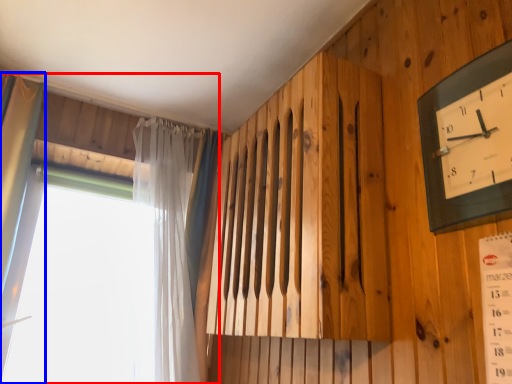
Question: Among these objects, which one is nearest to the camera, window (highlighted by a red box) or curtain (highlighted by a blue box)?

Choices:
 (A) window
 (B) curtain

Answer: (B)